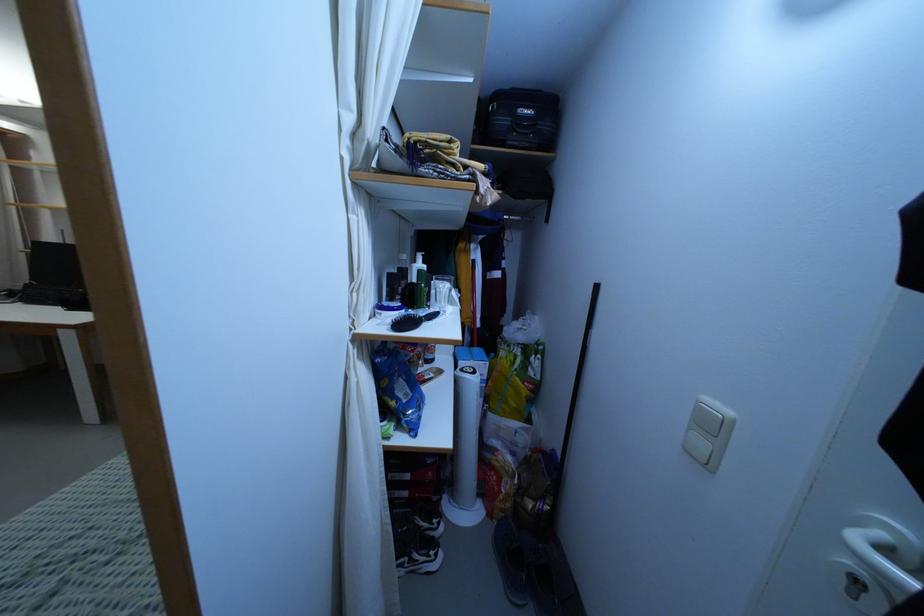
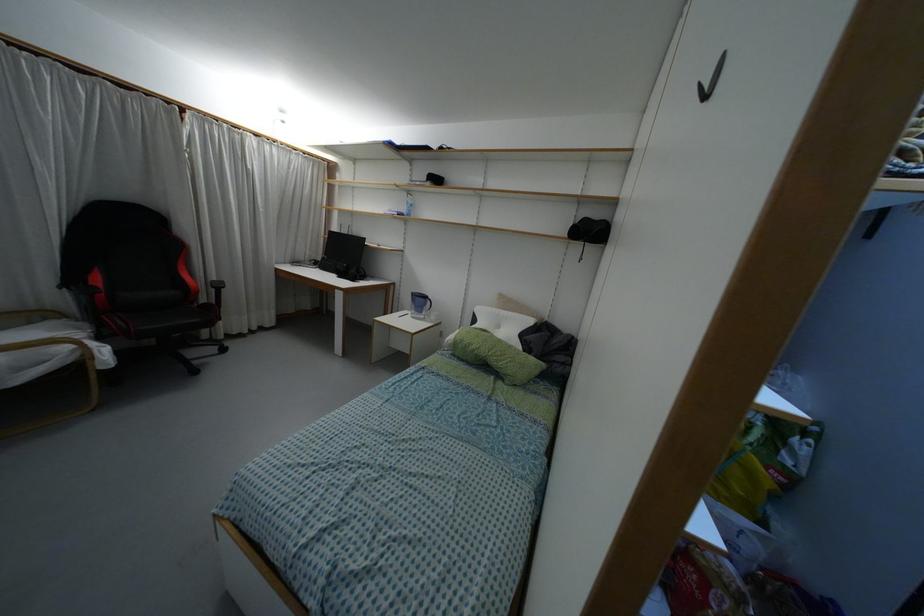
Question: What movement of the cameraman would produce the second image?

Choices:
 (A) Left
 (B) Right
 (C) Forward
 (D) Backward

Answer: (A)